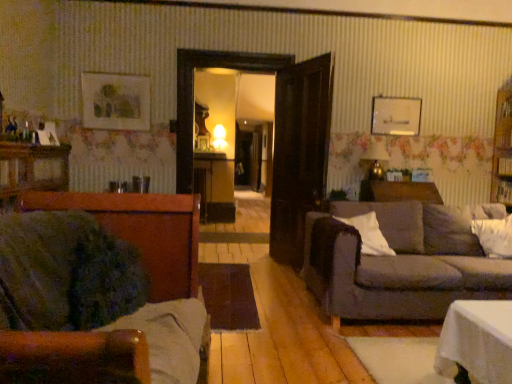
Question: Is white soft pillow at right, the second pillow in the right-to-left sequence, at the back of white soft pillow at right, which appears as the first pillow when viewed from the right?

Choices:
 (A) yes
 (B) no

Answer: (B)

Question: Considering the relative sizes of white soft pillow at right, which appears as the first pillow when viewed from the right, and white soft pillow at right, the second pillow in the right-to-left sequence, in the image provided, is white soft pillow at right, which appears as the first pillow when viewed from the right, bigger than white soft pillow at right, the second pillow in the right-to-left sequence,?

Choices:
 (A) yes
 (B) no

Answer: (A)

Question: From the image's perspective, is white soft pillow at right, which appears as the first pillow when viewed from the right, over white soft pillow at right, marked as the 1th pillow in a left-to-right arrangement?

Choices:
 (A) yes
 (B) no

Answer: (B)

Question: Does white soft pillow at right, which appears as the first pillow when viewed from the right, come behind white soft pillow at right, marked as the 1th pillow in a left-to-right arrangement?

Choices:
 (A) no
 (B) yes

Answer: (B)

Question: Considering the relative positions of white soft pillow at right, placed as the second pillow when sorted from left to right, and white soft pillow at right, the second pillow in the right-to-left sequence, in the image provided, is white soft pillow at right, placed as the second pillow when sorted from left to right, to the left of white soft pillow at right, the second pillow in the right-to-left sequence, from the viewer's perspective?

Choices:
 (A) yes
 (B) no

Answer: (B)

Question: Is point (139, 301) positioned closer to the camera than point (352, 307)?

Choices:
 (A) farther
 (B) closer

Answer: (B)

Question: From a real-world perspective, is velvet green couch at left, which is the first studio couch in front-to-back order, positioned above or below dark gray fabric couch at right, which is the 1th studio couch in right-to-left order?

Choices:
 (A) below
 (B) above

Answer: (B)

Question: Considering the positions of velvet green couch at left, which is the 1th studio couch in left-to-right order, and dark gray fabric couch at right, the 2th studio couch in the front-to-back sequence, in the image, is velvet green couch at left, which is the 1th studio couch in left-to-right order, wider or thinner than dark gray fabric couch at right, the 2th studio couch in the front-to-back sequence,?

Choices:
 (A) wide
 (B) thin

Answer: (B)

Question: Would you say velvet green couch at left, which is the second studio couch from right to left, is inside or outside dark gray fabric couch at right, the 2th studio couch in the front-to-back sequence?

Choices:
 (A) inside
 (B) outside

Answer: (B)

Question: Is brown wooden dresser at left spatially inside dark gray fabric couch at right, which is the 1th studio couch in right-to-left order, or outside of it?

Choices:
 (A) outside
 (B) inside

Answer: (A)

Question: Is point (56, 165) positioned closer to the camera than point (507, 288)?

Choices:
 (A) closer
 (B) farther

Answer: (B)

Question: Is brown wooden dresser at left bigger or smaller than dark gray fabric couch at right, the 2th studio couch in the front-to-back sequence?

Choices:
 (A) big
 (B) small

Answer: (B)

Question: From the image's perspective, relative to dark gray fabric couch at right, the second studio couch when ordered from left to right, is brown wooden dresser at left above or below?

Choices:
 (A) above
 (B) below

Answer: (A)

Question: From the image's perspective, is white soft pillow at right, placed as the second pillow when sorted from left to right, positioned above or below brown wooden dresser at left?

Choices:
 (A) above
 (B) below

Answer: (B)

Question: In terms of height, does white soft pillow at right, placed as the second pillow when sorted from left to right, look taller or shorter compared to brown wooden dresser at left?

Choices:
 (A) short
 (B) tall

Answer: (A)